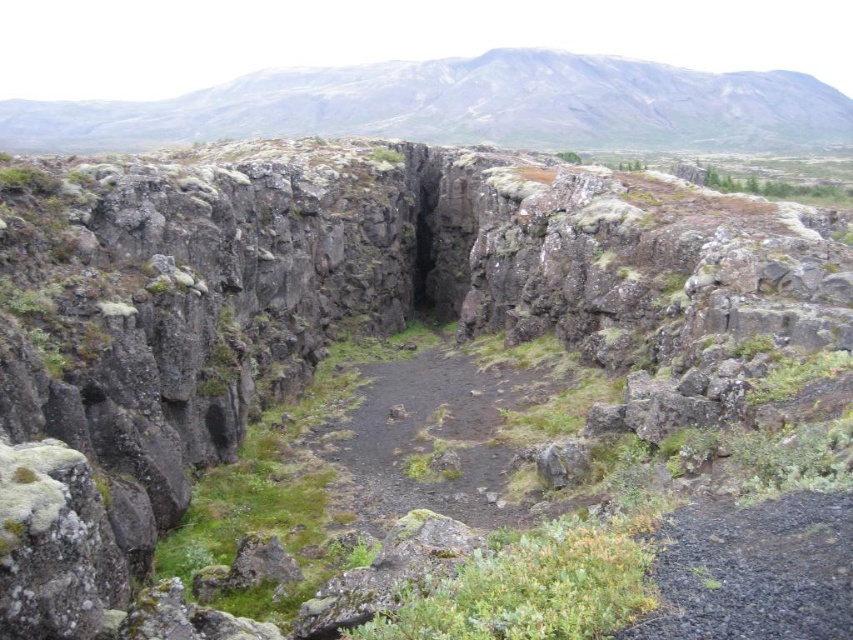
Question: Does gray rocky mountain at upper center have a lesser width compared to dull gray dirt path at center?

Choices:
 (A) no
 (B) yes

Answer: (A)

Question: Does gray rocky mountain at upper center come in front of dull gray dirt path at center?

Choices:
 (A) no
 (B) yes

Answer: (A)

Question: Among these objects, which one is nearest to the camera?

Choices:
 (A) gray rocky mountain at upper center
 (B) dull gray dirt path at center

Answer: (B)

Question: Which object is farther from the camera taking this photo?

Choices:
 (A) dull gray dirt path at center
 (B) gray rocky mountain at upper center

Answer: (B)

Question: Where is gray rocky mountain at upper center located in relation to dull gray dirt path at center in the image?

Choices:
 (A) below
 (B) above

Answer: (B)